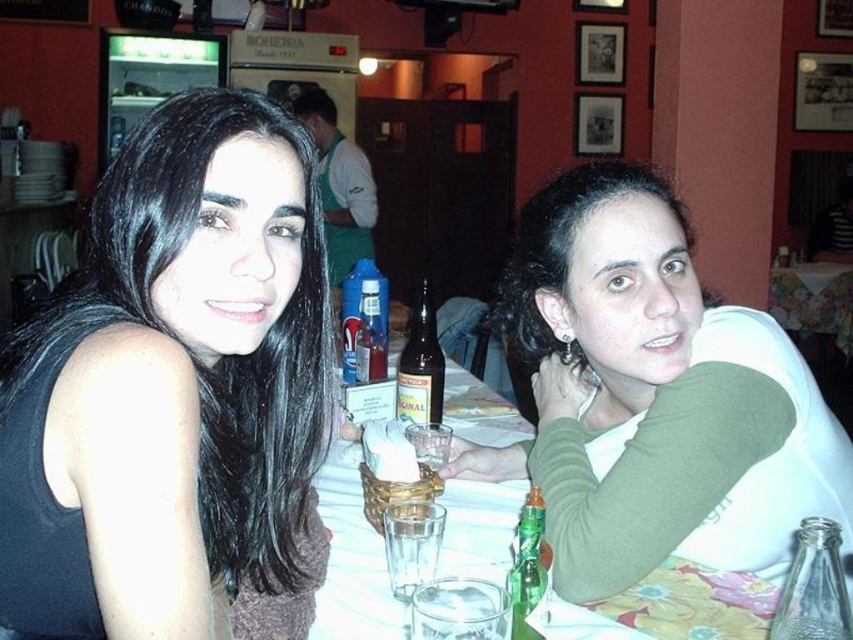
Question: Considering the relative positions of green matte shirt at upper right and green glass bottle at center in the image provided, where is green matte shirt at upper right located with respect to green glass bottle at center?

Choices:
 (A) below
 (B) above

Answer: (B)

Question: Which point appears farthest from the camera in this image?

Choices:
 (A) (579, 348)
 (B) (242, 467)
 (C) (822, 531)
 (D) (440, 390)

Answer: (D)

Question: Is green matte shirt at upper right bigger than green glass bottle at center?

Choices:
 (A) no
 (B) yes

Answer: (B)

Question: Does transparent glass bottle at lower right come behind green glass bottle at center?

Choices:
 (A) yes
 (B) no

Answer: (B)

Question: Which of the following is the closest to the observer?

Choices:
 (A) (360, 284)
 (B) (833, 426)
 (C) (412, 420)

Answer: (B)

Question: Based on their relative distances, which object is nearer to the translucent glass table at center?

Choices:
 (A) green glass bottle at center
 (B) transparent glass bottle at lower right
 (C) translucent plastic bottle at center

Answer: (A)